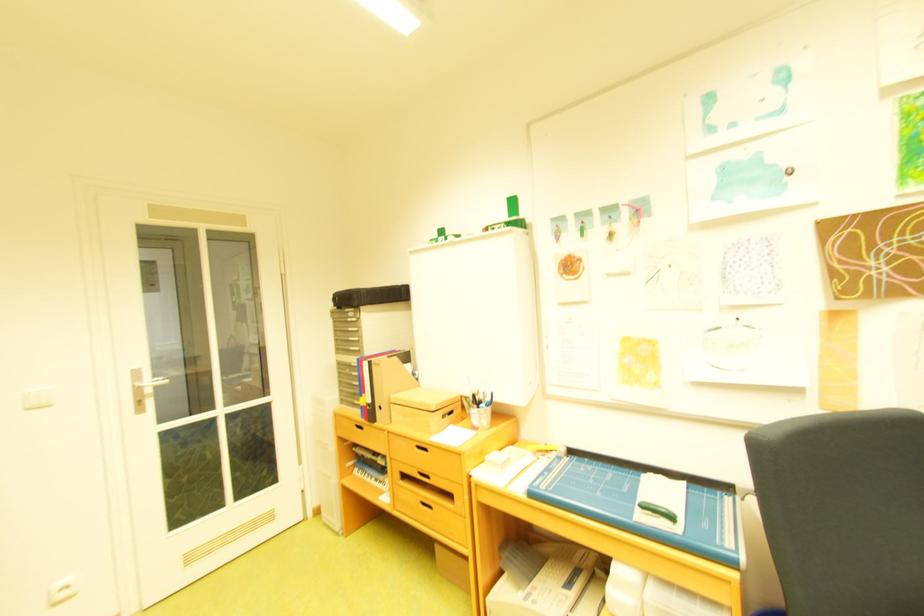
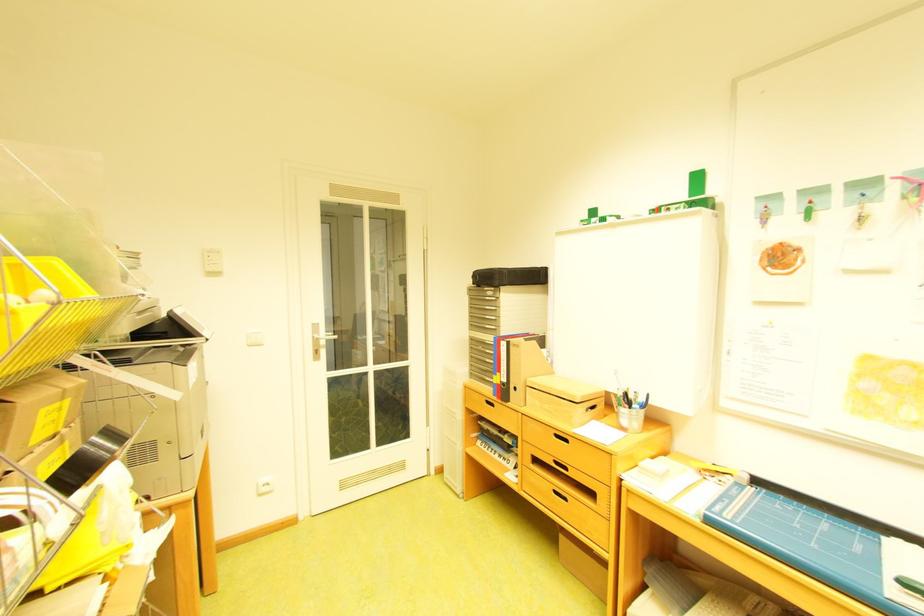
The point at (431, 448) is marked in the first image. Where is the corresponding point in the second image?

(568, 437)